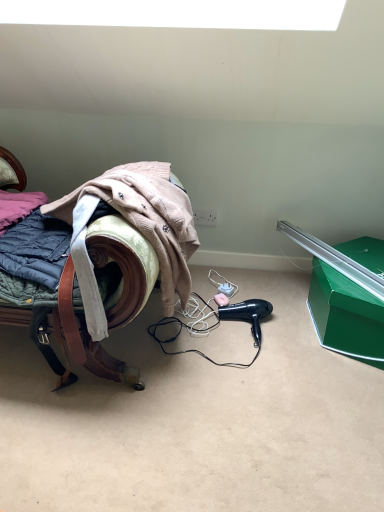
Question: Is black plastic hair dryer at lower center in contact with velvet green suitcase at left?

Choices:
 (A) no
 (B) yes

Answer: (A)

Question: From the image's perspective, is black plastic hair dryer at lower center below velvet green suitcase at left?

Choices:
 (A) no
 (B) yes

Answer: (B)

Question: Considering the relative positions of black plastic hair dryer at lower center and velvet green suitcase at left in the image provided, is black plastic hair dryer at lower center in front of velvet green suitcase at left?

Choices:
 (A) yes
 (B) no

Answer: (B)

Question: From the image's perspective, is black plastic hair dryer at lower center on top of velvet green suitcase at left?

Choices:
 (A) no
 (B) yes

Answer: (A)

Question: Is black plastic hair dryer at lower center oriented away from velvet green suitcase at left?

Choices:
 (A) no
 (B) yes

Answer: (A)

Question: Does black plastic hair dryer at lower center have a greater height compared to velvet green suitcase at left?

Choices:
 (A) yes
 (B) no

Answer: (B)

Question: From the image's perspective, would you say velvet green suitcase at left is shown under black plastic hair dryer at lower center?

Choices:
 (A) yes
 (B) no

Answer: (B)

Question: Does velvet green suitcase at left appear on the left side of black plastic hair dryer at lower center?

Choices:
 (A) no
 (B) yes

Answer: (B)

Question: Can you confirm if velvet green suitcase at left is shorter than black plastic hair dryer at lower center?

Choices:
 (A) yes
 (B) no

Answer: (B)

Question: Does velvet green suitcase at left lie in front of black plastic hair dryer at lower center?

Choices:
 (A) no
 (B) yes

Answer: (B)

Question: From a real-world perspective, is velvet green suitcase at left beneath black plastic hair dryer at lower center?

Choices:
 (A) yes
 (B) no

Answer: (B)

Question: Considering the relative sizes of velvet green suitcase at left and black plastic hair dryer at lower center in the image provided, is velvet green suitcase at left taller than black plastic hair dryer at lower center?

Choices:
 (A) no
 (B) yes

Answer: (B)

Question: Is green cardboard box at lower right positioned in front of black plastic hair dryer at lower center?

Choices:
 (A) yes
 (B) no

Answer: (A)